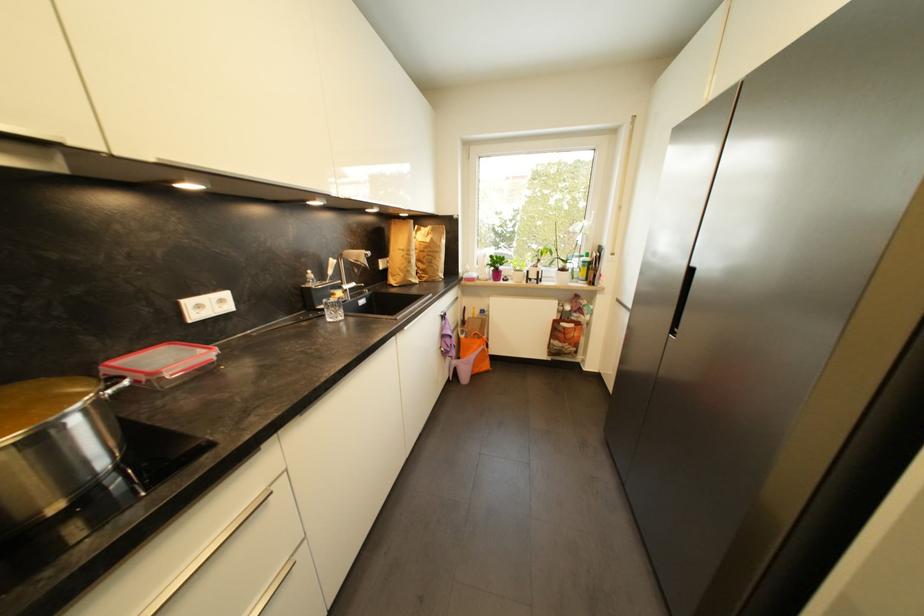
At what (x,y) coordinates should I click in order to perform the action: click on purple step stool. Please return your answer as a coordinate pair (x, y). This screenshot has height=616, width=924. Looking at the image, I should click on tap(468, 355).